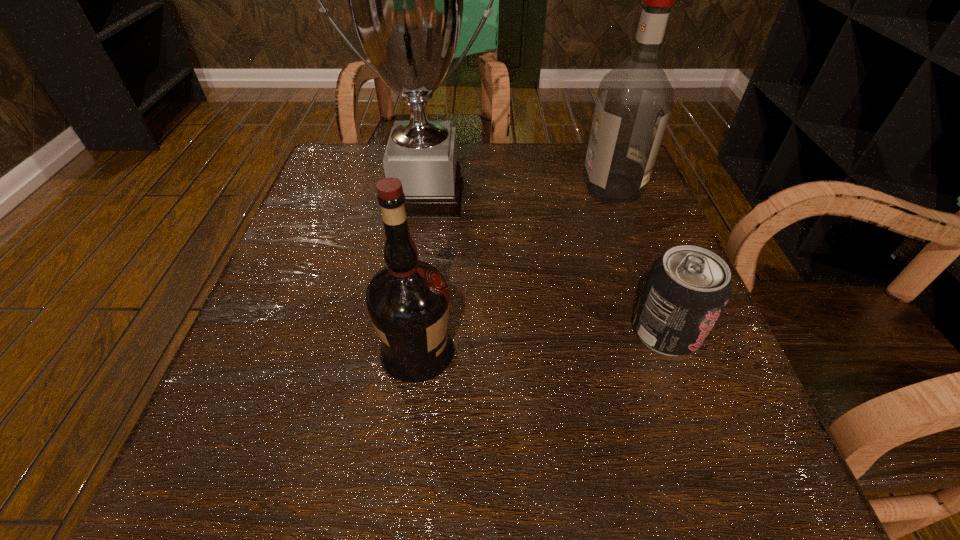
The image size is (960, 540). Find the location of `vacant area that satisfies the following two spatial constraints: 1. on the front-facing side of the right liquor; 2. on the left side of the shortest object`. vacant area that satisfies the following two spatial constraints: 1. on the front-facing side of the right liquor; 2. on the left side of the shortest object is located at coordinates (664, 332).

You are a GUI agent. You are given a task and a screenshot of the screen. Output one action in this format:
    pyautogui.click(x=<x>, y=<y>)
    Task: Click on the vacant region that satisfies the following two spatial constraints: 1. on the front-facing side of the soda can; 2. on the right side of the right liquor
    
    Given the screenshot: What is the action you would take?
    pyautogui.click(x=664, y=332)

Locate an element on the screen. This screenshot has width=960, height=540. vacant position in the image that satisfies the following two spatial constraints: 1. on the front-facing side of the right liquor; 2. on the left side of the soda can is located at coordinates (664, 332).

Where is `free space that satisfies the following two spatial constraints: 1. on the front-facing side of the third shortest object; 2. on the right side of the soda can`? This screenshot has width=960, height=540. free space that satisfies the following two spatial constraints: 1. on the front-facing side of the third shortest object; 2. on the right side of the soda can is located at coordinates (664, 332).

At what (x,y) coordinates should I click in order to perform the action: click on vacant space that satisfies the following two spatial constraints: 1. at the front view of the shortest object; 2. on the right side of the trophy cup. Please return your answer as a coordinate pair (x, y). The width and height of the screenshot is (960, 540). Looking at the image, I should click on coord(406,332).